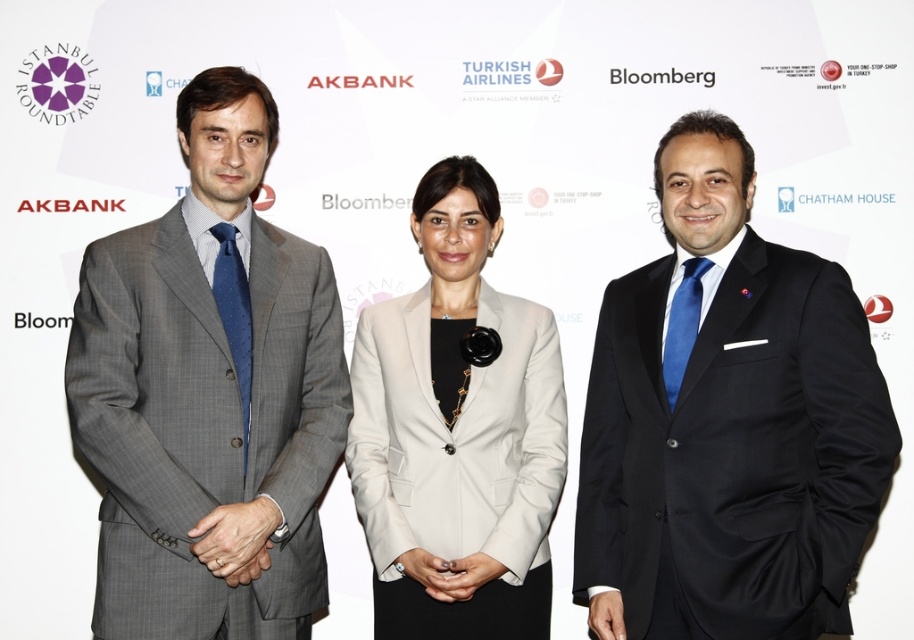
I want to click on black satin suit at right, so click(726, 422).

Is black satin suit at right bigger than light beige fabric blazer at center?

No.

Where is `black satin suit at right`? black satin suit at right is located at coordinates (726, 422).

This screenshot has width=914, height=640. Find the location of `black satin suit at right`. black satin suit at right is located at coordinates (726, 422).

Can you confirm if black satin suit at right is smaller than gray textured suit at left?

No.

Locate an element on the screen. The height and width of the screenshot is (640, 914). black satin suit at right is located at coordinates (726, 422).

What do you see at coordinates (209, 394) in the screenshot? This screenshot has width=914, height=640. I see `gray textured suit at left` at bounding box center [209, 394].

Is gray textured suit at left taller than light beige fabric blazer at center?

Correct, gray textured suit at left is much taller as light beige fabric blazer at center.

Is point (203, 627) farther from viewer compared to point (466, 570)?

No, it is not.

Where is `gray textured suit at left`? The image size is (914, 640). gray textured suit at left is located at coordinates (209, 394).